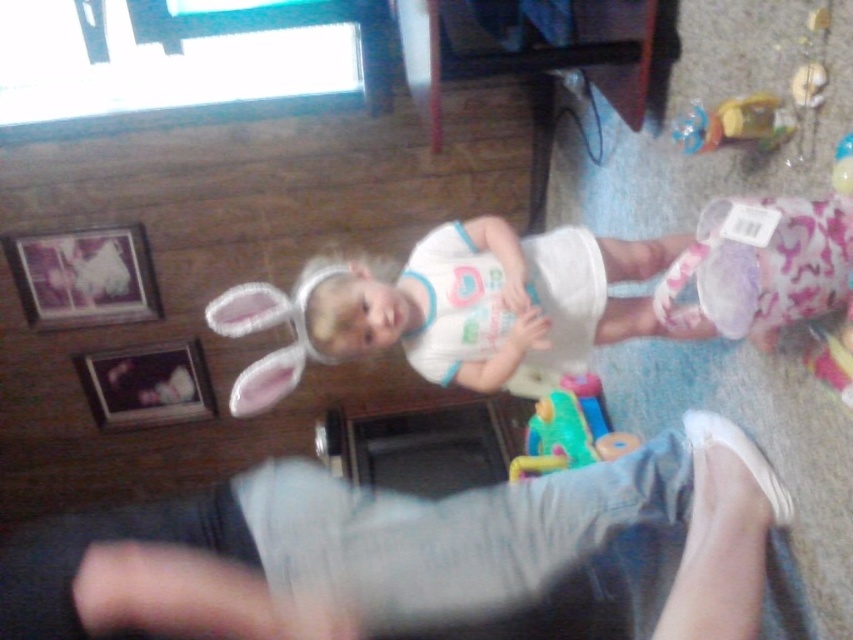
You are a photographer trying to hang two frames on a wall. You have the metallic silver picture frame at upper left and the wooden picture frame at left. If you want to place them side by side at the same height, which frame should you position higher so that their tops are aligned?

The metallic silver picture frame at upper left is taller than the wooden picture frame at left. To align their tops when placing them side by side, you should position the wooden picture frame at left higher so that its top matches the height of the metallic silver picture frame at upper left.

You are a photographer setting up for a family photo. You notice the metallic silver picture frame at upper left in the scene. Where exactly is it positioned in the image?

The metallic silver picture frame at upper left is located at point (83, 276) in the image.

You are a parent trying to tidy up the playroom. You see the wooden picture frame at left and the rubberized green toy at center. Which object should you pick up first if you want to start cleaning from the lowest point in the room?

The rubberized green toy at center should be picked up first because the wooden picture frame at left is above it, meaning the toy is lower.